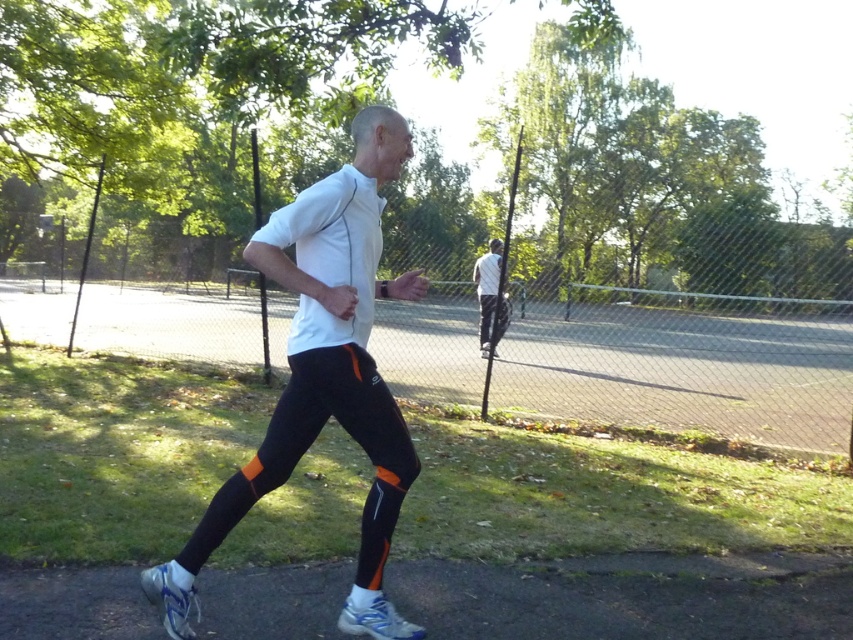
Question: In this image, where is white matte running pants at center located relative to white fabric shirt at center?

Choices:
 (A) right
 (B) left

Answer: (B)

Question: Which of these objects is positioned closest to the white mesh running shoe at lower left?

Choices:
 (A) white matte running pants at center
 (B) white fabric shirt at center

Answer: (A)

Question: Which of the following is the closest to the observer?

Choices:
 (A) white mesh running shoe at lower left
 (B) white fabric shirt at center
 (C) white matte running pants at center

Answer: (C)

Question: Which object is the farthest from the white matte running pants at center?

Choices:
 (A) white fabric shirt at center
 (B) white mesh running shoe at lower left

Answer: (A)

Question: Can you confirm if white mesh running shoe at lower left is thinner than white fabric shirt at center?

Choices:
 (A) yes
 (B) no

Answer: (A)

Question: Is white matte running pants at center bigger than white fabric shirt at center?

Choices:
 (A) no
 (B) yes

Answer: (B)